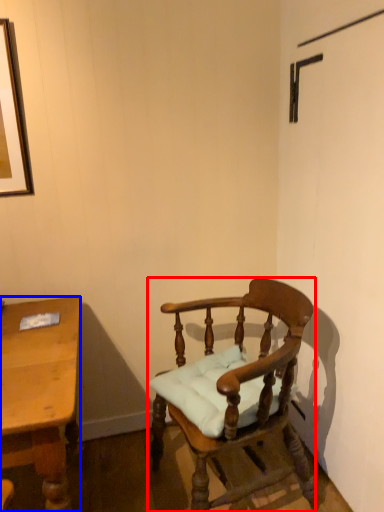
Question: Which object appears closest to the camera in this image, chair (highlighted by a red box) or desk (highlighted by a blue box)?

Choices:
 (A) chair
 (B) desk

Answer: (B)